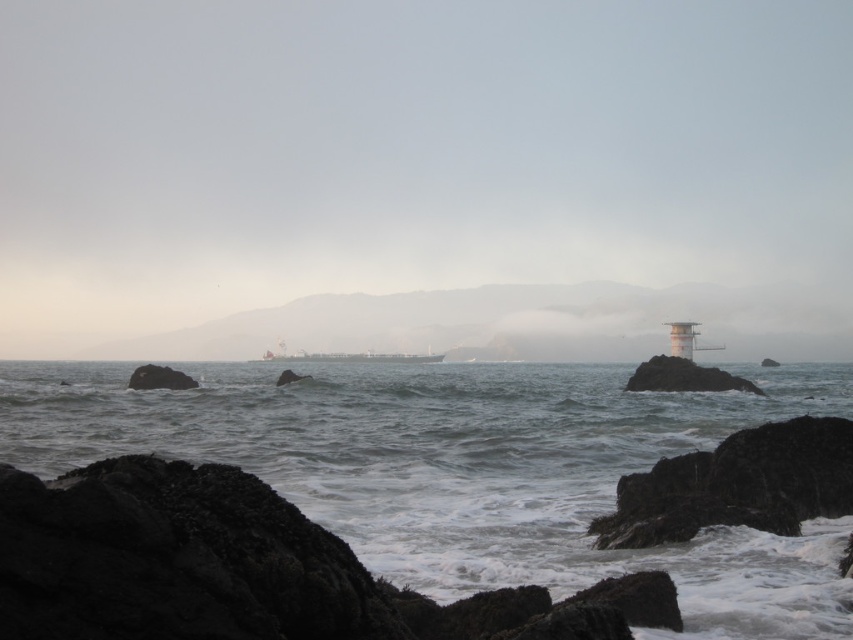
Question: Which of the following is the closest to the observer?

Choices:
 (A) dark gray rock at left
 (B) metallic gray ship at center
 (C) grayish water at center
 (D) white foggy sky at upper center

Answer: (C)

Question: Which is nearer to the white foggy sky at upper center?

Choices:
 (A) dark gray rock at left
 (B) grayish water at center

Answer: (B)

Question: Can you confirm if grayish water at center is positioned above metallic gray ship at center?

Choices:
 (A) no
 (B) yes

Answer: (B)

Question: Does metallic gray ship at center appear on the left side of dark gray rock at left?

Choices:
 (A) yes
 (B) no

Answer: (B)

Question: Which is farther from the grayish water at center?

Choices:
 (A) white foggy sky at upper center
 (B) dark gray rock at left
 (C) metallic gray ship at center

Answer: (A)

Question: Is metallic gray ship at center wider than dark gray rock at left?

Choices:
 (A) yes
 (B) no

Answer: (A)